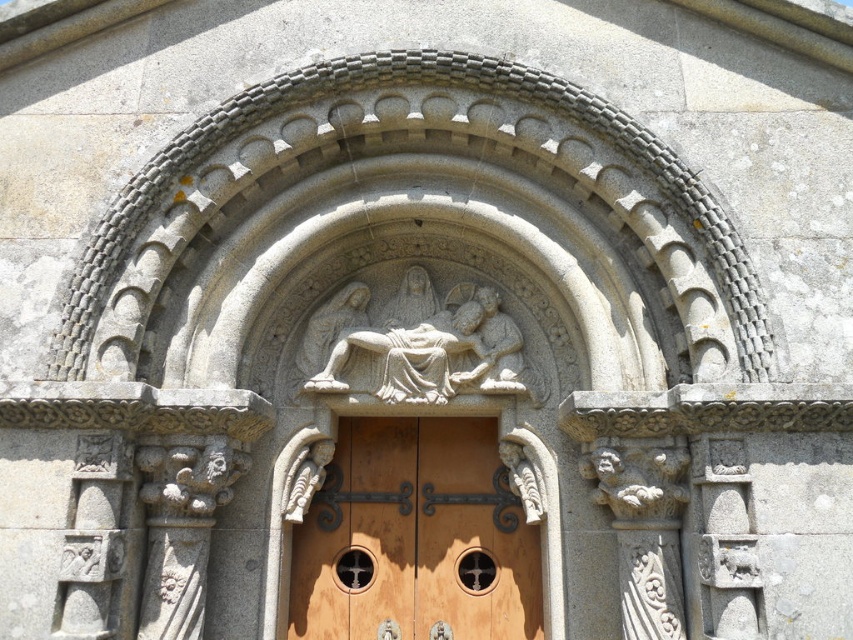
You are an architect examining this historical structure. You need to determine the spatial relationship between the wooden door at center and the gray stone carving at center. Which object is located above the other?

The wooden door at center is positioned under gray stone carving at center, so the gray stone carving at center is above the wooden door at center.

You are standing in front of the stone archway and want to touch both the wooden door at center and the gray stone carving at center. Which object should you reach for first to touch the one closer to you?

You should reach for the wooden door at center first because it is closer to you than the gray stone carving at center.